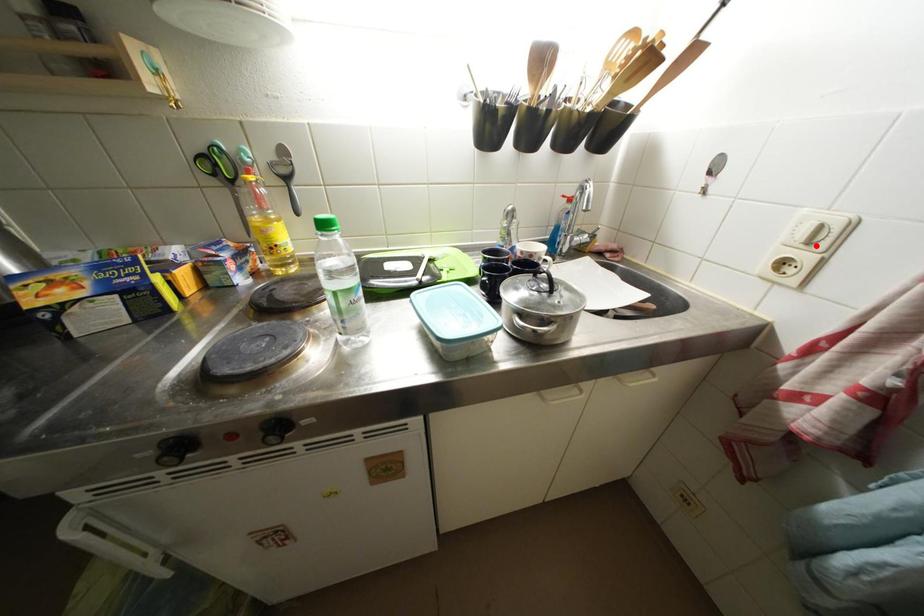
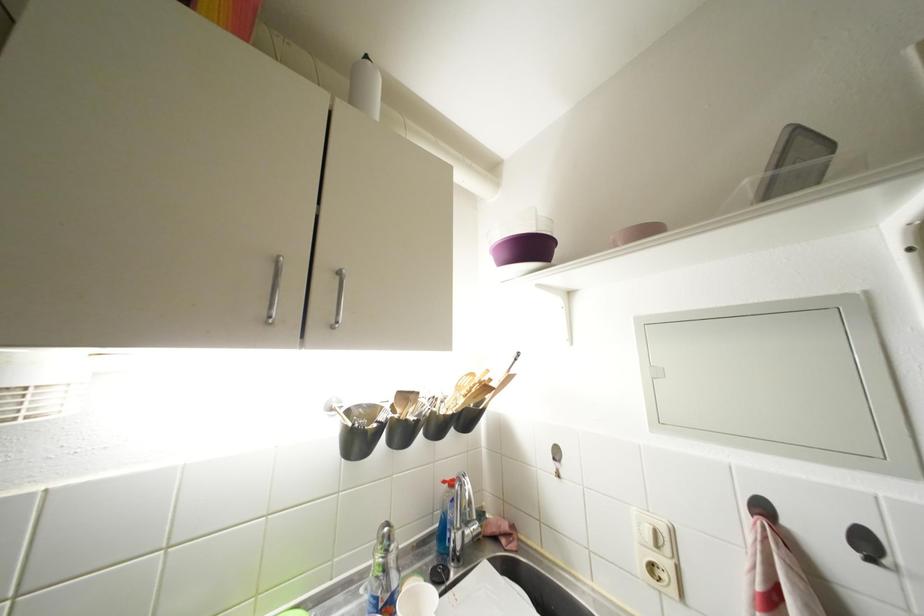
In the second image, find the point that corresponds to the highlighted location in the first image.

(663, 549)